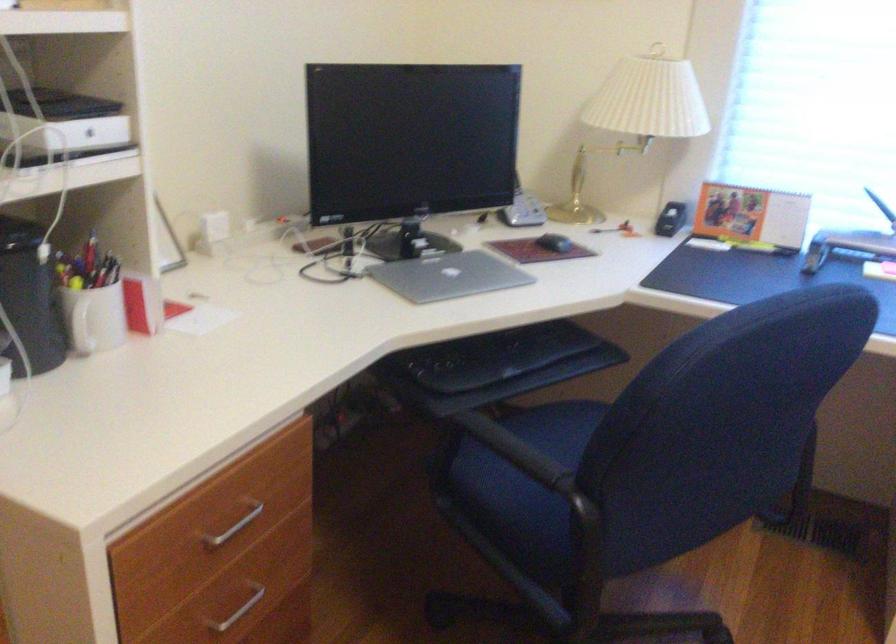
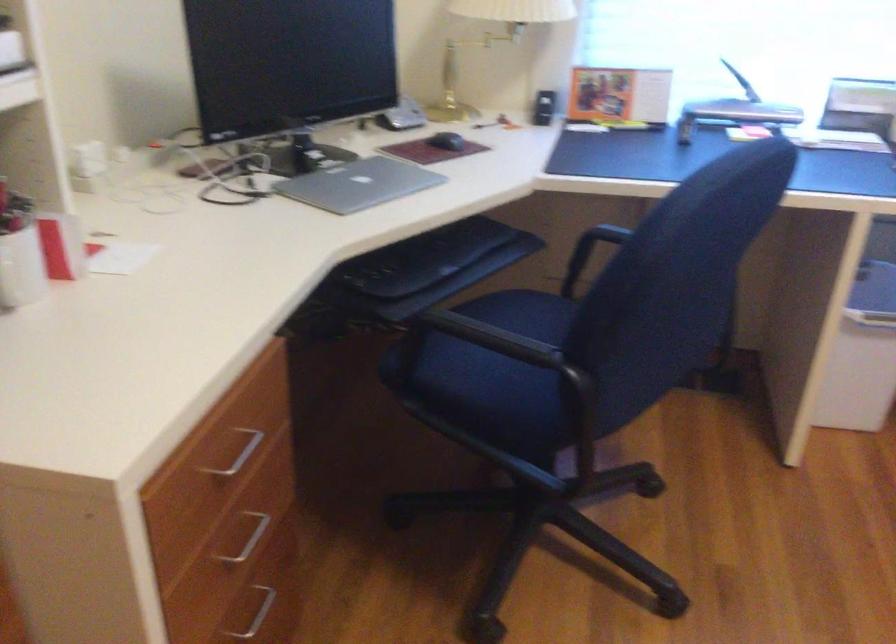
Find the pixel in the second image that matches point 234,514 in the first image.

(238, 453)